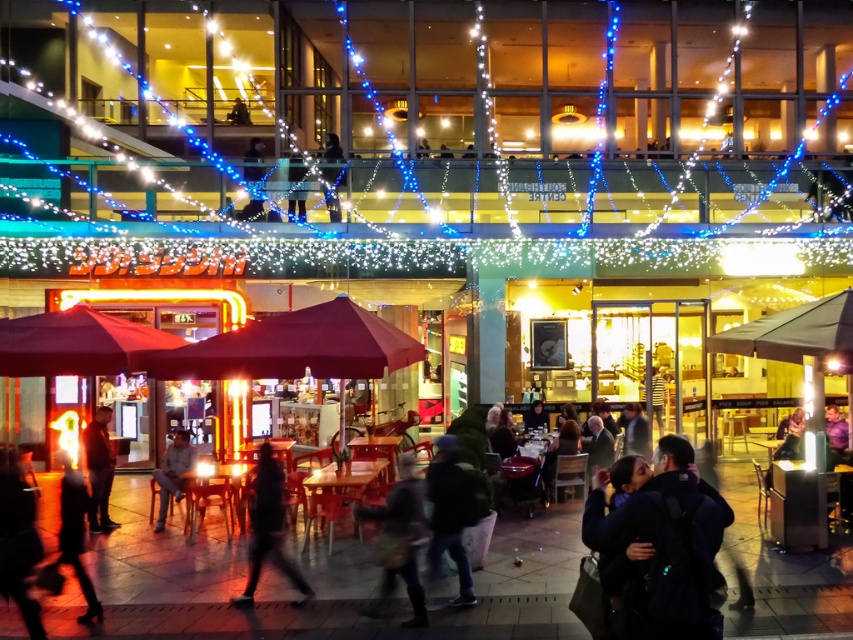
Is dark gray fabric umbrella at right thinner than dark gray jacket at center?

No, dark gray fabric umbrella at right is not thinner than dark gray jacket at center.

Which of these two, dark gray fabric umbrella at right or dark gray jacket at center, stands shorter?

dark gray fabric umbrella at right

Who is more distant from viewer, (778,326) or (405,508)?

Positioned behind is point (778,326).

Identify the location of dark gray fabric umbrella at right. (795, 333).

Who is more distant from viewer, (170, 148) or (102, 529)?

Point (170, 148)

Between point (128, 234) and point (102, 515), which one is positioned behind?

Point (128, 234)

Locate an element on the screen. This screenshot has width=853, height=640. white string lights at upper center is located at coordinates (426, 132).

Does point (851, 312) lie in front of point (161, 486)?

Yes, point (851, 312) is in front of point (161, 486).

Which is behind, point (820, 333) or point (183, 490)?

Point (183, 490)

Is point (822, 301) more distant than point (169, 454)?

No, (822, 301) is in front of (169, 454).

At what (x,y) coordinates should I click in order to perform the action: click on dark gray fabric umbrella at right. Please return your answer as a coordinate pair (x, y). Image resolution: width=853 pixels, height=640 pixels. Looking at the image, I should click on (795, 333).